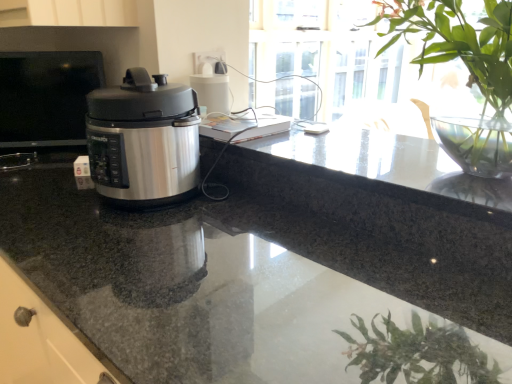
This screenshot has height=384, width=512. What do you see at coordinates (46, 97) in the screenshot?
I see `metallic silver pressure cooker at left` at bounding box center [46, 97].

Describe the element at coordinates (264, 272) in the screenshot. The image size is (512, 384). I see `granite countertop at center` at that location.

I want to click on green leafy plant at upper right, so click(x=468, y=69).

The height and width of the screenshot is (384, 512). Find the location of `metallic silver pressure cooker at left`. metallic silver pressure cooker at left is located at coordinates (46, 97).

Does point (147, 130) appear closer or farther from the camera than point (497, 366)?

Point (147, 130) appears to be farther away from the viewer than point (497, 366).

Looking at the image, does satin silver pressure cooker at left seem bigger or smaller compared to granite countertop at center?

Clearly, satin silver pressure cooker at left is smaller in size than granite countertop at center.

In the image, is satin silver pressure cooker at left on the left side or the right side of granite countertop at center?

Clearly, satin silver pressure cooker at left is on the left of granite countertop at center in the image.

What are the coordinates of `home appliance that is above the granite countertop at center (from the image's perspective)` in the screenshot? It's located at tap(143, 141).

Is metallic silver pressure cooker at left thinner than granite countertop at center?

Indeed, metallic silver pressure cooker at left has a lesser width compared to granite countertop at center.

What's the angular difference between metallic silver pressure cooker at left and granite countertop at center's facing directions?

There is a 52.6-degree angle between the facing directions of metallic silver pressure cooker at left and granite countertop at center.

Considering the relative positions of metallic silver pressure cooker at left and granite countertop at center in the image provided, is metallic silver pressure cooker at left to the left or to the right of granite countertop at center?

Based on their positions, metallic silver pressure cooker at left is located to the left of granite countertop at center.

From a real-world perspective, who is located higher, metallic silver pressure cooker at left or granite countertop at center?

In real-world perspective, metallic silver pressure cooker at left is above.

Locate an element on the screen. The width and height of the screenshot is (512, 384). home appliance that appears behind the green leafy plant at upper right is located at coordinates [143, 141].

From the picture: Can you confirm if satin silver pressure cooker at left is smaller than green leafy plant at upper right?

A: Yes.

Does satin silver pressure cooker at left appear on the left side of green leafy plant at upper right?

Indeed, satin silver pressure cooker at left is positioned on the left side of green leafy plant at upper right.

From a real-world perspective, is green leafy plant at upper right beneath satin silver pressure cooker at left?

No.

Can you tell me how much green leafy plant at upper right and satin silver pressure cooker at left differ in facing direction?

The facing directions of green leafy plant at upper right and satin silver pressure cooker at left are 4.75 degrees apart.

Is the surface of green leafy plant at upper right in direct contact with satin silver pressure cooker at left?

No, green leafy plant at upper right is not beside satin silver pressure cooker at left.

Is green leafy plant at upper right oriented towards satin silver pressure cooker at left?

No.

Does green leafy plant at upper right turn towards granite countertop at center?

No.

Which is behind, point (453, 152) or point (241, 282)?

The point (453, 152) is behind.

Is green leafy plant at upper right touching granite countertop at center?

green leafy plant at upper right is not next to granite countertop at center, and they're not touching.

From a real-world perspective, who is located higher, green leafy plant at upper right or granite countertop at center?

green leafy plant at upper right is physically above.

In the scene shown: How many degrees apart are the facing directions of granite countertop at center and metallic silver pressure cooker at left?

The angular difference between granite countertop at center and metallic silver pressure cooker at left is 52.6 degrees.

From the image's perspective, is granite countertop at center above or below metallic silver pressure cooker at left?

From the image's perspective, granite countertop at center appears below metallic silver pressure cooker at left.

Which object is closer to the camera, granite countertop at center or metallic silver pressure cooker at left?

granite countertop at center is closer to the camera.

From a real-world perspective, is granite countertop at center on metallic silver pressure cooker at left?

Actually, granite countertop at center is physically below metallic silver pressure cooker at left in the real world.

Is metallic silver pressure cooker at left at the back of satin silver pressure cooker at left?

That's not correct — satin silver pressure cooker at left is not looking away from metallic silver pressure cooker at left.

Does satin silver pressure cooker at left have a greater width compared to metallic silver pressure cooker at left?

Yes, satin silver pressure cooker at left is wider than metallic silver pressure cooker at left.

Is satin silver pressure cooker at left at the left side of metallic silver pressure cooker at left?

No, satin silver pressure cooker at left is not to the left of metallic silver pressure cooker at left.

Can you confirm if satin silver pressure cooker at left is bigger than metallic silver pressure cooker at left?

Yes.

In the image, there is a granite countertop at center. Find the location of `home appliance above it (from the image's perspective)`. home appliance above it (from the image's perspective) is located at coordinates click(143, 141).

This screenshot has width=512, height=384. I want to click on countertop below the metallic silver pressure cooker at left (from a real-world perspective), so [264, 272].

Considering their positions, is granite countertop at center positioned further to satin silver pressure cooker at left than metallic silver pressure cooker at left?

metallic silver pressure cooker at left is further to satin silver pressure cooker at left.

Estimate the real-world distances between objects in this image. Which object is further from satin silver pressure cooker at left, green leafy plant at upper right or granite countertop at center?

green leafy plant at upper right is further to satin silver pressure cooker at left.

When comparing their distances from metallic silver pressure cooker at left, does granite countertop at center or green leafy plant at upper right seem closer?

The object closer to metallic silver pressure cooker at left is granite countertop at center.

Looking at the image, which one is located closer to satin silver pressure cooker at left, green leafy plant at upper right or metallic silver pressure cooker at left?

Among the two, metallic silver pressure cooker at left is located nearer to satin silver pressure cooker at left.

Which object lies further to the anchor point granite countertop at center, satin silver pressure cooker at left or metallic silver pressure cooker at left?

Based on the image, metallic silver pressure cooker at left appears to be further to granite countertop at center.

Looking at this image, estimate the real-world distances between objects in this image. Which object is closer to green leafy plant at upper right, metallic silver pressure cooker at left or satin silver pressure cooker at left?

Based on the image, satin silver pressure cooker at left appears to be nearer to green leafy plant at upper right.

From the image, which object appears to be farther from granite countertop at center, green leafy plant at upper right or metallic silver pressure cooker at left?

green leafy plant at upper right is further to granite countertop at center.

Based on their spatial positions, is satin silver pressure cooker at left or granite countertop at center closer to metallic silver pressure cooker at left?

granite countertop at center is positioned closer to the anchor metallic silver pressure cooker at left.

You are a GUI agent. You are given a task and a screenshot of the screen. Output one action in this format:
    pyautogui.click(x=<x>, y=<y>)
    Task: Click on the countertop situated between metallic silver pressure cooker at left and green leafy plant at upper right from left to right
    The width and height of the screenshot is (512, 384).
    Given the screenshot: What is the action you would take?
    (x=264, y=272)

This screenshot has width=512, height=384. What are the coordinates of `countertop between satin silver pressure cooker at left and green leafy plant at upper right in the horizontal direction` in the screenshot? It's located at (264, 272).

Locate an element on the screen. This screenshot has height=384, width=512. home appliance situated between metallic silver pressure cooker at left and green leafy plant at upper right from left to right is located at coordinates (143, 141).

This screenshot has width=512, height=384. I want to click on home appliance located between granite countertop at center and metallic silver pressure cooker at left in the depth direction, so point(143,141).